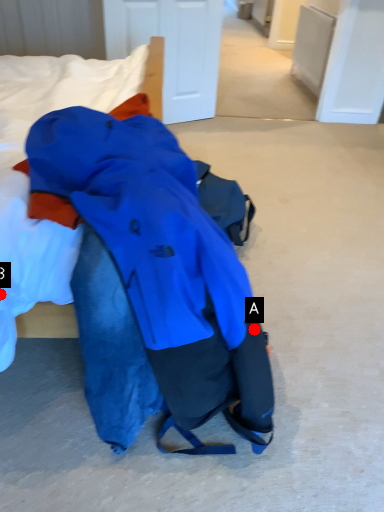
Question: Two points are circled on the image, labeled by A and B beside each circle. Which point is farther to the camera?

Choices:
 (A) A is further
 (B) B is further

Answer: (A)